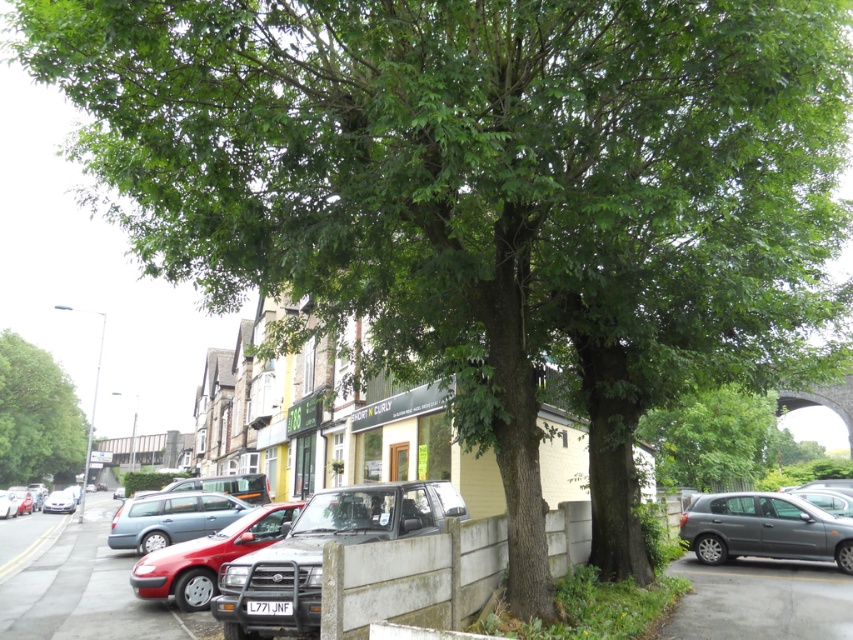
You are a delivery driver who needs to park your vehicle between two large trees on the right side of the street. You have a matte black suv at center and a matte gray station wagon at center. Which vehicle will require more vertical space to park between the trees?

The matte black suv at center is taller than the matte gray station wagon at center, so it will require more vertical space to park between the trees.

You are standing at the point with coordinates point (x=229, y=580) and want to walk to the point with coordinates point (x=683, y=472). Based on the scene description, will you have to go around any obstacles or can you walk straight?

Since point (x=229, y=580) is in front of point (x=683, y=472), you will have to walk around any obstacles between them, but according to the scene description, there are no mentioned obstacles blocking the path. However, the description does not provide information about potential obstacles between the two points, so it is uncertain if you can walk straight or need to go around.